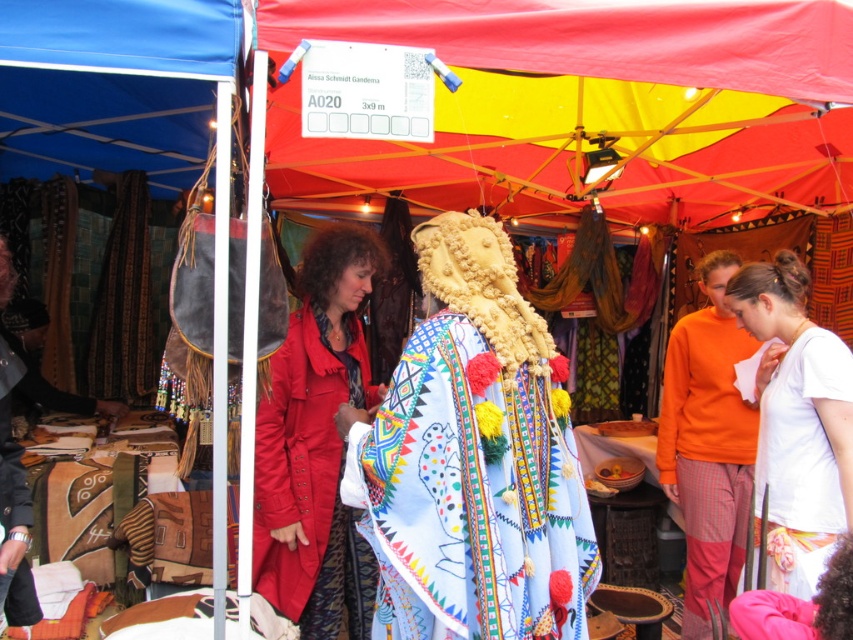
Question: Is orange cotton sweater at right smaller than matte black jacket at left?

Choices:
 (A) no
 (B) yes

Answer: (A)

Question: Which point is closer to the camera taking this photo?

Choices:
 (A) (509, 211)
 (B) (33, 605)

Answer: (B)

Question: Which object is farther from the camera taking this photo?

Choices:
 (A) matte red coat at center
 (B) matte black jacket at left

Answer: (A)

Question: Among these objects, which one is farthest from the camera?

Choices:
 (A) white cotton shirt at center
 (B) orange cotton sweater at right
 (C) matte black jacket at left
 (D) matte red coat at center

Answer: (B)

Question: Can you confirm if textured fabric cape at center is positioned below orange cotton sweater at right?

Choices:
 (A) no
 (B) yes

Answer: (A)

Question: Is matte red coat at center bigger than matte black jacket at left?

Choices:
 (A) yes
 (B) no

Answer: (A)